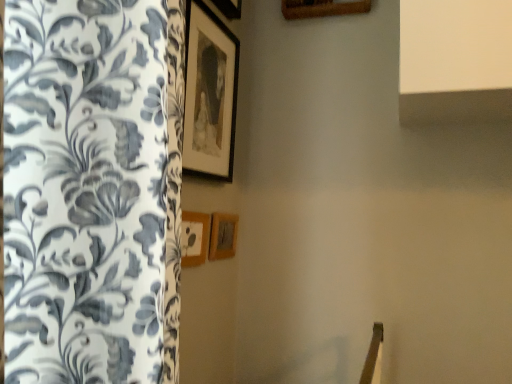
Question: Does point (232, 59) appear closer or farther from the camera than point (233, 218)?

Choices:
 (A) closer
 (B) farther

Answer: (A)

Question: In the image, is matte black picture frame at upper center, which is the first picture frame in top-to-bottom order, on the left side or the right side of wooden picture frame at center, the 1th picture frame in the bottom-to-top sequence?

Choices:
 (A) left
 (B) right

Answer: (A)

Question: Estimate the real-world distances between objects in this image. Which object is farther from the wooden picture frame at center, which is the 2th picture frame in bottom-to-top order?

Choices:
 (A) wooden picture frame at center, which is the third picture frame from top to bottom
 (B) matte black picture frame at upper center, the 3th picture frame ordered from the bottom

Answer: (B)

Question: Which is farther from the wooden picture frame at center, the 1th picture frame in the bottom-to-top sequence?

Choices:
 (A) matte black picture frame at upper center, which is the first picture frame in top-to-bottom order
 (B) wooden picture frame at center, which ranks as the second picture frame in top-to-bottom order

Answer: (A)